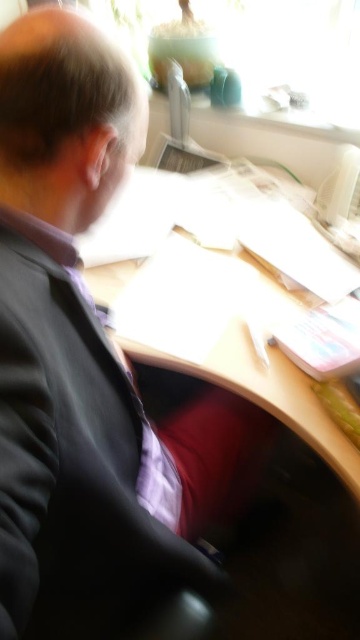
Can you confirm if black matte suit at center is wider than wooden desk at center?

No.

What are the coordinates of `black matte suit at center` in the screenshot? It's located at (72, 468).

Locate an element on the screen. The width and height of the screenshot is (360, 640). black matte suit at center is located at coordinates (72, 468).